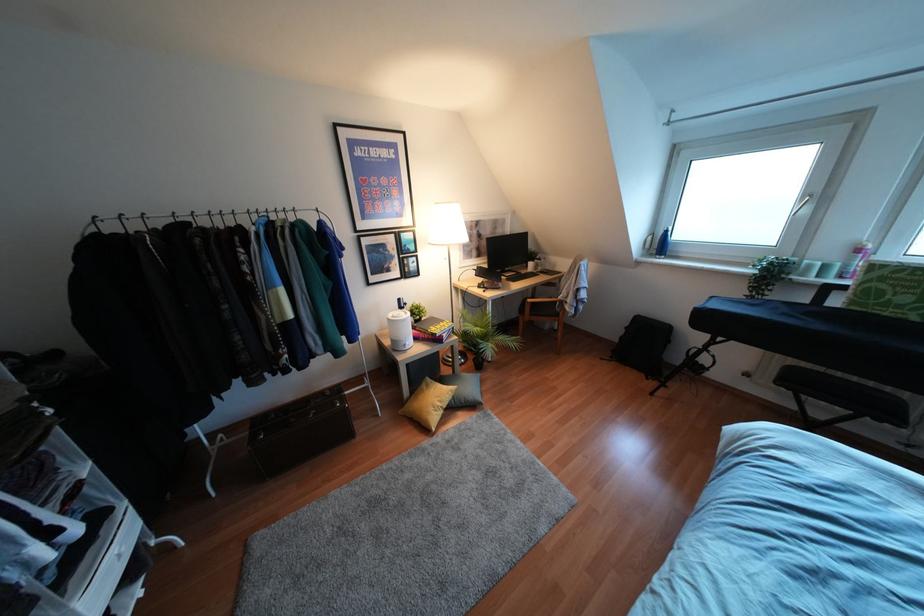
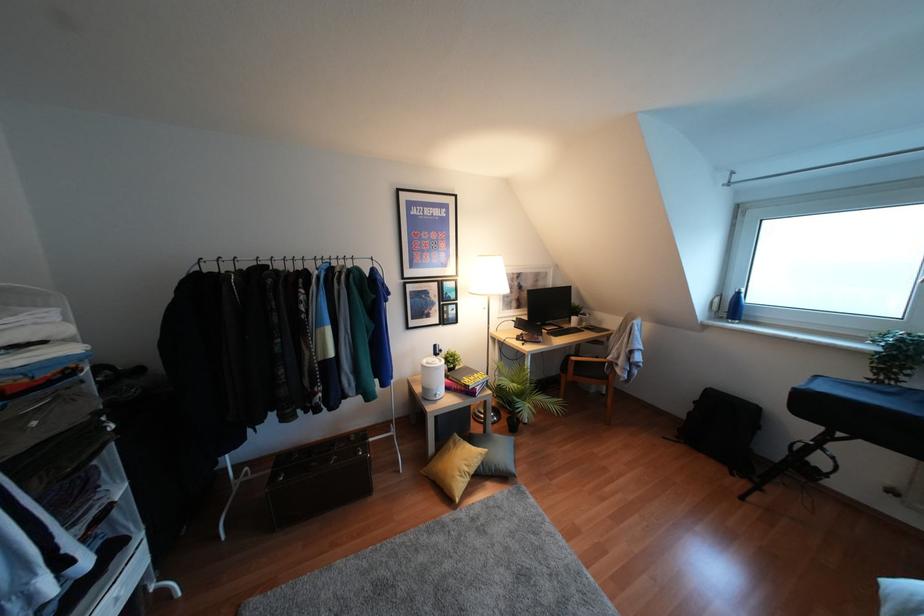
What movement of the cameraman would produce the second image?

The cameraman walked toward left, forward.